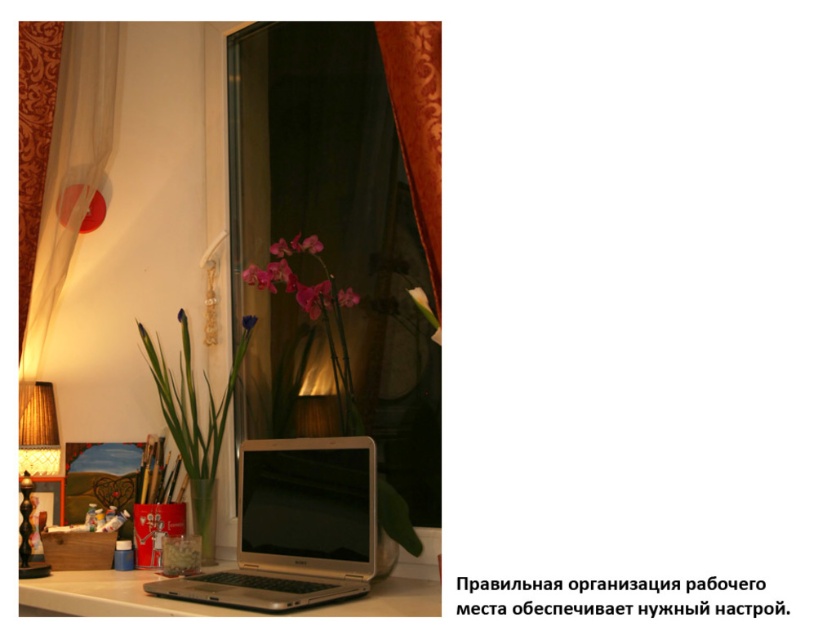
Who is more forward, (281, 576) or (292, 240)?

Point (281, 576) is more forward.

Looking at this image, which is more to the left, satin silver laptop at center or matte pink orchid at center?

satin silver laptop at center

You are a GUI agent. You are given a task and a screenshot of the screen. Output one action in this format:
    pyautogui.click(x=<x>, y=<y>)
    Task: Click on the satin silver laptop at center
    
    Given the screenshot: What is the action you would take?
    pyautogui.click(x=294, y=528)

Does satin silver laptop at center appear over white glossy table at lower center?

Correct, satin silver laptop at center is located above white glossy table at lower center.

Measure the distance from satin silver laptop at center to white glossy table at lower center.

satin silver laptop at center and white glossy table at lower center are 14.48 centimeters apart.

The height and width of the screenshot is (640, 836). I want to click on satin silver laptop at center, so click(294, 528).

The height and width of the screenshot is (640, 836). I want to click on satin silver laptop at center, so [x=294, y=528].

How much distance is there between wooden textured lampshade at left and purple matte flower at center?

wooden textured lampshade at left and purple matte flower at center are 23.39 inches apart from each other.

Locate an element on the screen. This screenshot has width=836, height=640. wooden textured lampshade at left is located at coordinates (38, 417).